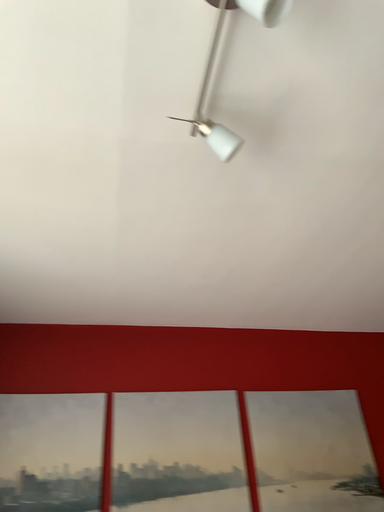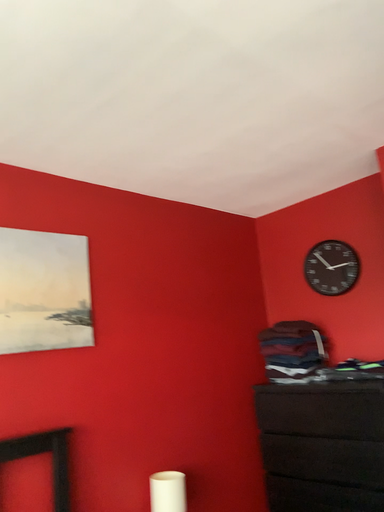
Question: Which way did the camera rotate in the video?

Choices:
 (A) rotated right
 (B) rotated left

Answer: (A)